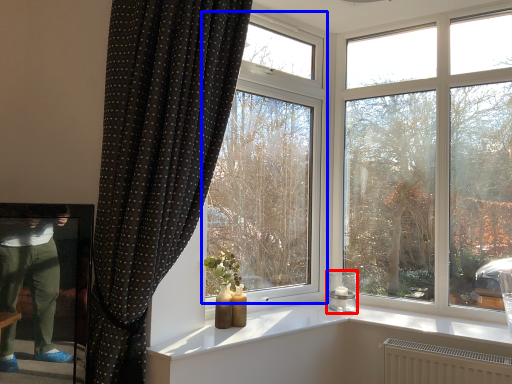
Question: Which object appears farthest to the camera in this image, candle holder (highlighted by a red box) or window (highlighted by a blue box)?

Choices:
 (A) candle holder
 (B) window

Answer: (A)